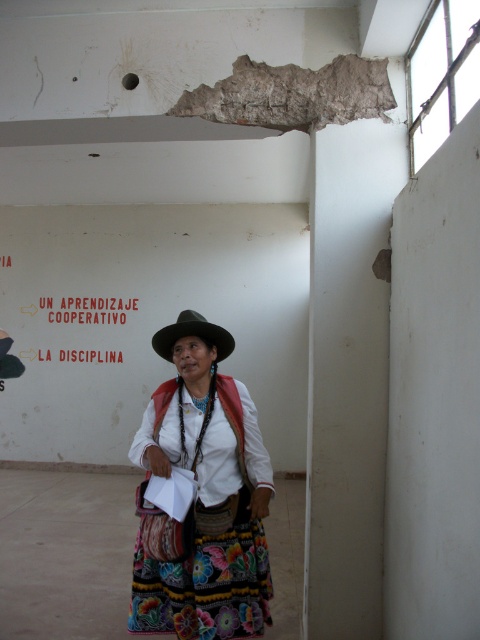
Is embroidered fabric skirt at center taller than red paper sign at upper center?

Yes.

Can you confirm if embroidered fabric skirt at center is wider than red paper sign at upper center?

No.

I want to click on embroidered fabric skirt at center, so (x=202, y=496).

Between embroidered fabric skirt at center and green felt cowboy hat at center, which one appears on the left side from the viewer's perspective?

From the viewer's perspective, green felt cowboy hat at center appears more on the left side.

Who is more forward, (240, 436) or (201, 333)?

Point (240, 436) is in front.

Between point (186, 316) and point (166, 340), which one is positioned behind?

The point (186, 316) is behind.

Identify the location of embroidered fabric skirt at center. (202, 496).

Consider the image. Does red paper sign at upper center have a lesser height compared to green felt cowboy hat at center?

In fact, red paper sign at upper center may be taller than green felt cowboy hat at center.

Is red paper sign at upper center above green felt cowboy hat at center?

Indeed, red paper sign at upper center is positioned over green felt cowboy hat at center.

I want to click on red paper sign at upper center, so click(x=88, y=308).